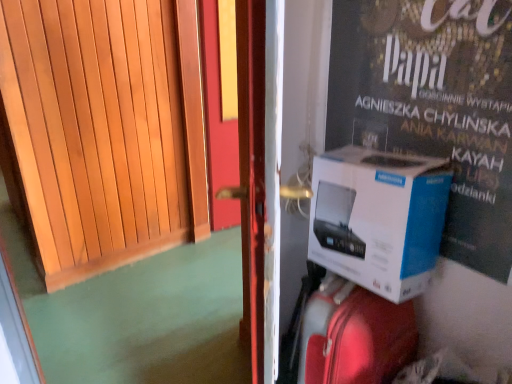
Question: Is the position of shiny red suitcase at center more distant than that of white cardboard box at right?

Choices:
 (A) yes
 (B) no

Answer: (A)

Question: From a real-world perspective, is shiny red suitcase at center located higher than white cardboard box at right?

Choices:
 (A) yes
 (B) no

Answer: (B)

Question: From the image's perspective, would you say shiny red suitcase at center is positioned over white cardboard box at right?

Choices:
 (A) yes
 (B) no

Answer: (B)

Question: From the image's perspective, would you say shiny red suitcase at center is shown under white cardboard box at right?

Choices:
 (A) no
 (B) yes

Answer: (B)

Question: Would you say white cardboard box at right is part of shiny red suitcase at center's contents?

Choices:
 (A) yes
 (B) no

Answer: (B)

Question: Based on their sizes in the image, would you say white cardboard box at right is bigger or smaller than shiny red suitcase at center?

Choices:
 (A) big
 (B) small

Answer: (B)

Question: From the image's perspective, relative to shiny red suitcase at center, is white cardboard box at right above or below?

Choices:
 (A) above
 (B) below

Answer: (A)

Question: In the image, is white cardboard box at right on the left side or the right side of shiny red suitcase at center?

Choices:
 (A) right
 (B) left

Answer: (A)

Question: Is point (332, 178) positioned closer to the camera than point (387, 329)?

Choices:
 (A) farther
 (B) closer

Answer: (A)

Question: Is point (451, 200) closer or farther from the camera than point (429, 162)?

Choices:
 (A) farther
 (B) closer

Answer: (A)

Question: From the image's perspective, is white cardboard box at right positioned above or below white cardboard box at right?

Choices:
 (A) below
 (B) above

Answer: (B)

Question: Considering the positions of white cardboard box at right and white cardboard box at right in the image, is white cardboard box at right taller or shorter than white cardboard box at right?

Choices:
 (A) short
 (B) tall

Answer: (B)

Question: Is white cardboard box at right wider or thinner than white cardboard box at right?

Choices:
 (A) thin
 (B) wide

Answer: (A)

Question: Is shiny red suitcase at center spatially inside wooden door at left, or outside of it?

Choices:
 (A) inside
 (B) outside

Answer: (B)

Question: From a real-world perspective, is shiny red suitcase at center positioned above or below wooden door at left?

Choices:
 (A) above
 (B) below

Answer: (B)